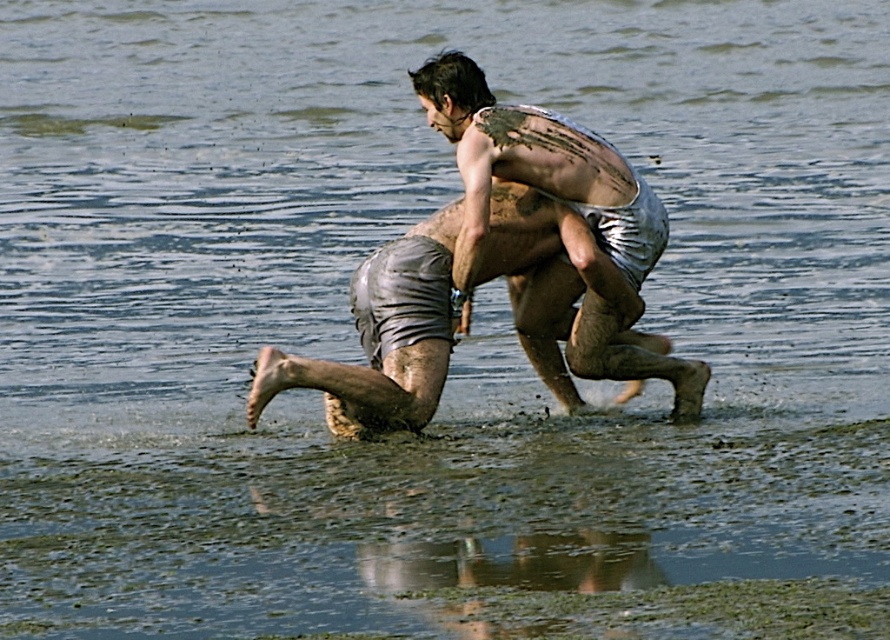
Question: Which of the following is the farthest from the observer?

Choices:
 (A) (823, 480)
 (B) (455, 56)
 (C) (514, 141)

Answer: (C)

Question: Which is farther from the muddy wet ground at lower center?

Choices:
 (A) muddy skin torso at center
 (B) muddy skin at upper center

Answer: (B)

Question: Observing the image, what is the correct spatial positioning of muddy wet ground at lower center in reference to muddy skin at upper center?

Choices:
 (A) below
 (B) above

Answer: (A)

Question: In this image, where is muddy wet ground at lower center located relative to muddy skin at upper center?

Choices:
 (A) right
 (B) left

Answer: (B)

Question: Does muddy wet ground at lower center appear on the left side of muddy skin torso at center?

Choices:
 (A) no
 (B) yes

Answer: (B)

Question: Among these points, which one is nearest to the camera?

Choices:
 (A) (185, 493)
 (B) (636, 371)

Answer: (A)